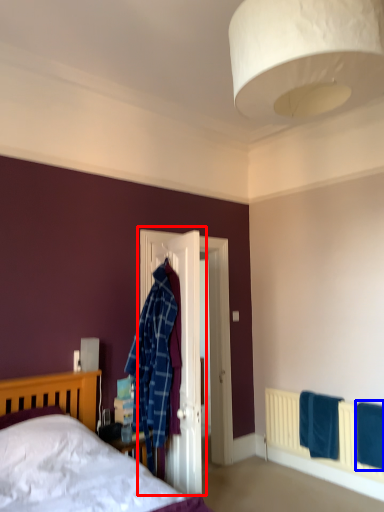
Question: Which point is further to the camera, door (highlighted by a red box) or bath towel (highlighted by a blue box)?

Choices:
 (A) door
 (B) bath towel

Answer: (A)